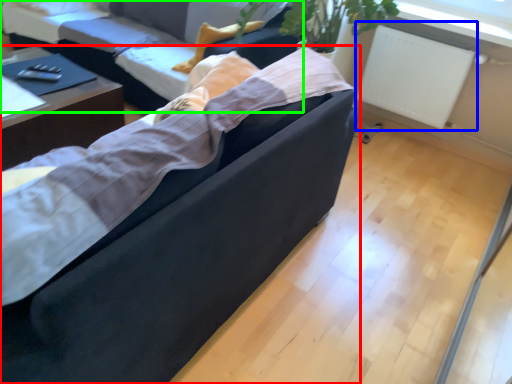
Question: Which object is positioned farthest from studio couch (highlighted by a red box)? Select from radiator (highlighted by a blue box) and studio couch (highlighted by a green box).

Choices:
 (A) radiator
 (B) studio couch

Answer: (A)